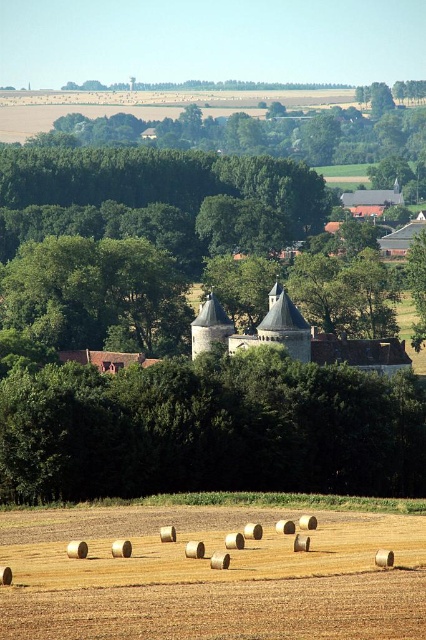
You are a photographer standing at the edge of the field. You want to capture a photo that includes both the golden straw bales at lower center and the brown stone castle at center. Based on their sizes, which object will appear larger in the photo?

The brown stone castle at center will appear larger in the photo because it is taller than the golden straw bales at lower center.

You are standing at the origin point in the image. There are two points marked in the scene. Which point is closer to you, point (138, 403) or point (101, 618)?

Point (101, 618) is closer to you because it is in front of point (138, 403), which is behind it.

You are standing at the center of the field with cylindrical hay bales around you. You want to walk towards the green leafy tree at center. Which direction should you walk?

The green leafy tree at center is located at point 0.672 on the x axis and 0.493 on the y axis. Since you are at the center of the field, which is point 0.5 on both axes, you should walk northeast to reach the green leafy tree at center.